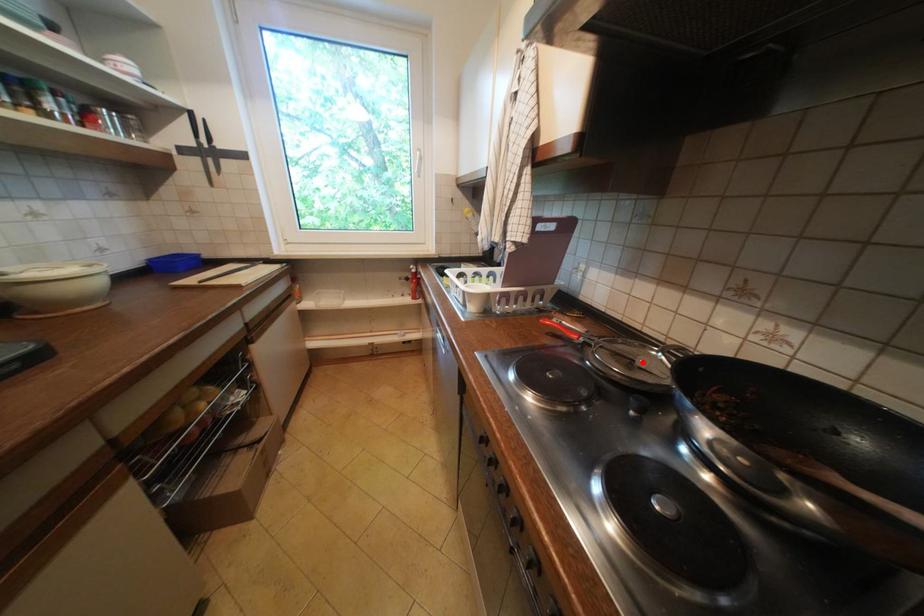
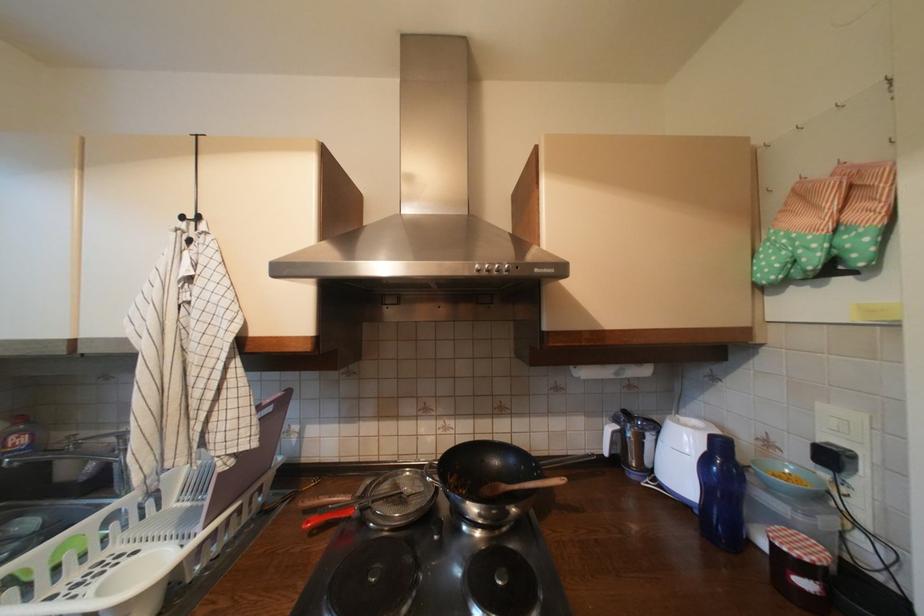
Locate, in the second image, the point that corresponds to the highlighted location in the first image.

(410, 495)